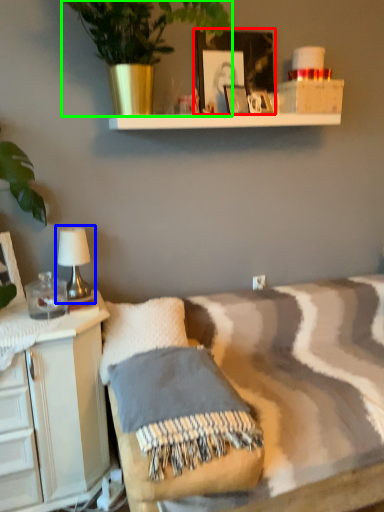
Question: Considering the real-world distances, which object is closest to picture frame (highlighted by a red box)? table lamp (highlighted by a blue box) or houseplant (highlighted by a green box).

Choices:
 (A) table lamp
 (B) houseplant

Answer: (B)